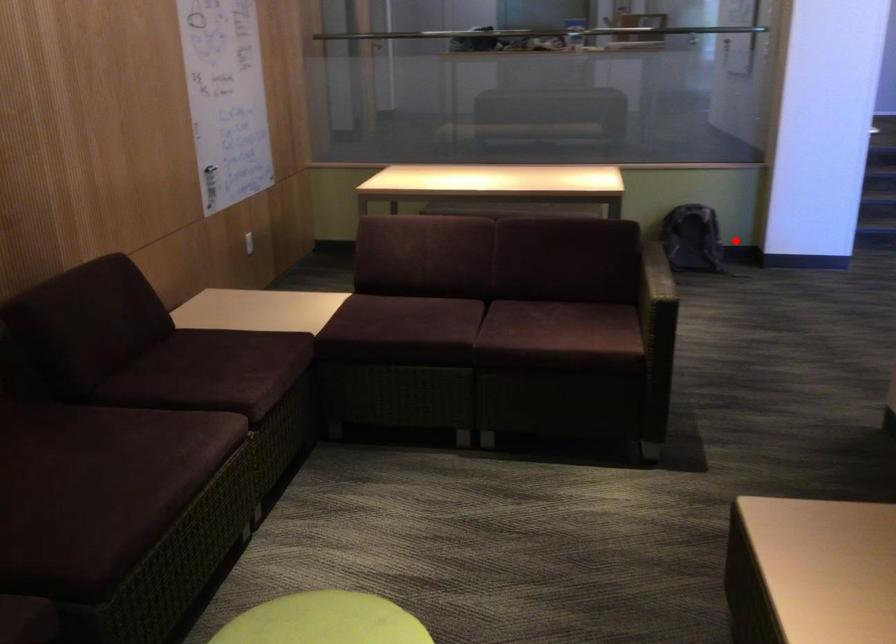
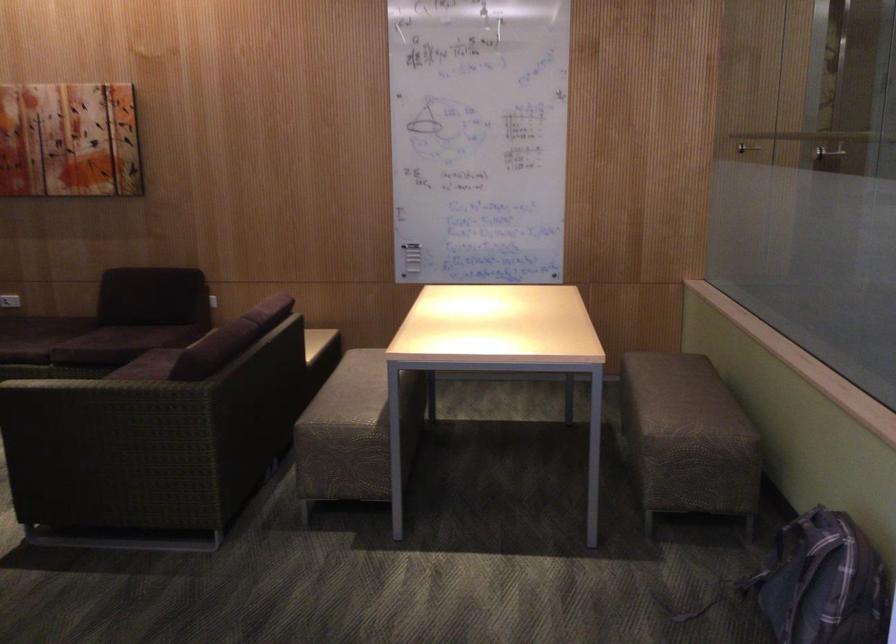
Find the pixel in the second image that matches the highlighted location in the first image.

(823, 583)